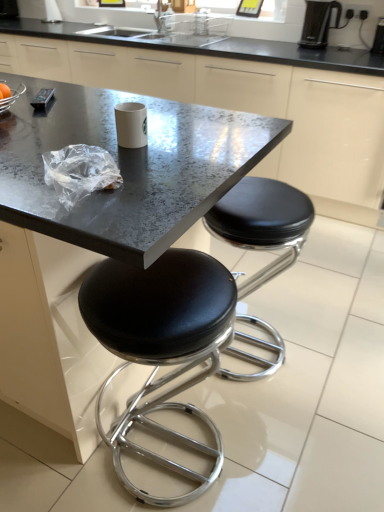
Describe the element at coordinates (161, 344) in the screenshot. The width and height of the screenshot is (384, 512). I see `black leather stool at lower center, the second stool viewed from the right` at that location.

What do you see at coordinates (239, 97) in the screenshot?
I see `black granite countertop at center` at bounding box center [239, 97].

Locate an element on the screen. The image size is (384, 512). black granite countertop at center is located at coordinates (239, 97).

Locate an element on the screen. This screenshot has height=512, width=384. black plastic coffee machine at upper right is located at coordinates (318, 23).

Locate an element on the screen. The image size is (384, 512). white glossy paper cup at center is located at coordinates 131,124.

You are a GUI agent. You are given a task and a screenshot of the screen. Output one action in this format:
    pyautogui.click(x=<x>, y=<y>)
    Task: Click on the metallic gray table at center
    The height and width of the screenshot is (512, 384).
    Given the screenshot: What is the action you would take?
    pyautogui.click(x=98, y=230)

Is metallic gray table at center far from black plastic coffee machine at upper right?

Yes, metallic gray table at center and black plastic coffee machine at upper right are quite far apart.

Would you say metallic gray table at center is inside or outside black plastic coffee machine at upper right?

metallic gray table at center is spatially situated outside black plastic coffee machine at upper right.

From a real-world perspective, who is located higher, metallic gray table at center or black plastic coffee machine at upper right?

black plastic coffee machine at upper right is physically above.

Who is bigger, metallic gray table at center or black plastic coffee machine at upper right?

metallic gray table at center is bigger.

From the image's perspective, between black leather stool at center, acting as the 2th stool starting from the left, and white glossy paper cup at center, who is located below?

From the image's view, black leather stool at center, acting as the 2th stool starting from the left, is below.

Which object is closer to the camera, black leather stool at center, acting as the 2th stool starting from the left, or white glossy paper cup at center?

white glossy paper cup at center is closer to the camera.

Considering the relative sizes of black leather stool at center, which is counted as the 1th stool, starting from the right, and white glossy paper cup at center in the image provided, is black leather stool at center, which is counted as the 1th stool, starting from the right, thinner than white glossy paper cup at center?

No.

Image resolution: width=384 pixels, height=512 pixels. Identify the location of paper cup that appears above the black leather stool at center, which is counted as the 1th stool, starting from the right (from the image's perspective). click(x=131, y=124).

Is black plastic coffee machine at upper right thinner than black plastic coffee maker at upper right?

No, black plastic coffee machine at upper right is not thinner than black plastic coffee maker at upper right.

Considering the positions of objects black plastic coffee machine at upper right and black plastic coffee maker at upper right in the image provided, who is more to the right, black plastic coffee machine at upper right or black plastic coffee maker at upper right?

Positioned to the right is black plastic coffee maker at upper right.

Which of these two, black plastic coffee machine at upper right or black plastic coffee maker at upper right, stands shorter?

black plastic coffee maker at upper right.

Consider the image. Does black plastic coffee machine at upper right turn towards black plastic coffee maker at upper right?

No, black plastic coffee machine at upper right is not aimed at black plastic coffee maker at upper right.

Between black leather stool at center, which is counted as the 1th stool, starting from the right, and black plastic coffee maker at upper right, which one appears on the right side from the viewer's perspective?

black plastic coffee maker at upper right is more to the right.

From a real-world perspective, which is physically below, black leather stool at center, acting as the 2th stool starting from the left, or black plastic coffee maker at upper right?

In real-world perspective, black leather stool at center, acting as the 2th stool starting from the left, is lower.

Which object is wider, black leather stool at center, which is counted as the 1th stool, starting from the right, or black plastic coffee maker at upper right?

Wider between the two is black leather stool at center, which is counted as the 1th stool, starting from the right.

From a real-world perspective, who is located lower, black leather stool at lower center, the second stool viewed from the right, or black plastic coffee maker at upper right?

black leather stool at lower center, the second stool viewed from the right, is physically lower.

Is black leather stool at lower center, the 1th stool in the left-to-right sequence, positioned behind black plastic coffee maker at upper right?

No, it is not.

Which object is more forward, black plastic coffee machine at upper right or metallic gray table at center?

metallic gray table at center is more forward.

Considering the sizes of objects black plastic coffee machine at upper right and metallic gray table at center in the image provided, who is smaller, black plastic coffee machine at upper right or metallic gray table at center?

black plastic coffee machine at upper right.

In the scene shown: Is black plastic coffee machine at upper right oriented away from metallic gray table at center?

No, black plastic coffee machine at upper right is not facing the opposite direction of metallic gray table at center.

Is point (327, 32) positioned after point (68, 354)?

That is True.

Based on the photo, are black plastic coffee machine at upper right and black leather stool at center, acting as the 2th stool starting from the left, making contact?

No, black plastic coffee machine at upper right is not making contact with black leather stool at center, acting as the 2th stool starting from the left.

Does point (317, 22) lie in front of point (246, 234)?

No, it is not.

From a real-world perspective, is black plastic coffee machine at upper right located beneath black leather stool at center, acting as the 2th stool starting from the left?

Actually, black plastic coffee machine at upper right is physically above black leather stool at center, acting as the 2th stool starting from the left, in the real world.

Between black plastic coffee machine at upper right and black leather stool at center, acting as the 2th stool starting from the left, which one has smaller size?

Smaller between the two is black plastic coffee machine at upper right.

Identify the location of coffee machine lying on the right of metallic gray table at center. The width and height of the screenshot is (384, 512). (318, 23).

Identify the location of paper cup positioned vertically above the black leather stool at center, acting as the 2th stool starting from the left (from a real-world perspective). (131, 124).

When comparing their distances from black plastic coffee machine at upper right, does white glossy paper cup at center or black granite countertop at center seem further?

white glossy paper cup at center is further to black plastic coffee machine at upper right.

Looking at the image, which one is located further to black leather stool at center, which is counted as the 1th stool, starting from the right, metallic gray table at center or black plastic coffee machine at upper right?

black plastic coffee machine at upper right.

Considering their positions, is black plastic coffee maker at upper right positioned closer to white glossy paper cup at center than black granite countertop at center?

Based on the image, black granite countertop at center appears to be nearer to white glossy paper cup at center.

Which object lies further to the anchor point black plastic coffee machine at upper right, black leather stool at center, acting as the 2th stool starting from the left, or black leather stool at lower center, the second stool viewed from the right?

black leather stool at lower center, the second stool viewed from the right, is positioned further to the anchor black plastic coffee machine at upper right.

Considering their positions, is black leather stool at lower center, the second stool viewed from the right, positioned further to black plastic coffee maker at upper right than black granite countertop at center?

Based on the image, black leather stool at lower center, the second stool viewed from the right, appears to be further to black plastic coffee maker at upper right.

When comparing their distances from black plastic coffee maker at upper right, does white glossy paper cup at center or metallic gray table at center seem further?

metallic gray table at center is further to black plastic coffee maker at upper right.

Based on their spatial positions, is black plastic coffee maker at upper right or black leather stool at center, acting as the 2th stool starting from the left, further from black plastic coffee machine at upper right?

black leather stool at center, acting as the 2th stool starting from the left.

When comparing their distances from black granite countertop at center, does white glossy paper cup at center or black plastic coffee machine at upper right seem further?

Among the two, white glossy paper cup at center is located further to black granite countertop at center.

Locate an element on the screen. counter between white glossy paper cup at center and black plastic coffee machine at upper right from front to back is located at coordinates (239, 97).

The width and height of the screenshot is (384, 512). Identify the location of table between white glossy paper cup at center and black leather stool at lower center, the 1th stool in the left-to-right sequence, vertically. (98, 230).

Where is `stool between black granite countertop at center and black leather stool at lower center, the 1th stool in the left-to-right sequence, from top to bottom`? Image resolution: width=384 pixels, height=512 pixels. stool between black granite countertop at center and black leather stool at lower center, the 1th stool in the left-to-right sequence, from top to bottom is located at coordinates (262, 223).

Find the location of a particular element. counter located between metallic gray table at center and black plastic coffee machine at upper right in the depth direction is located at coordinates (239, 97).